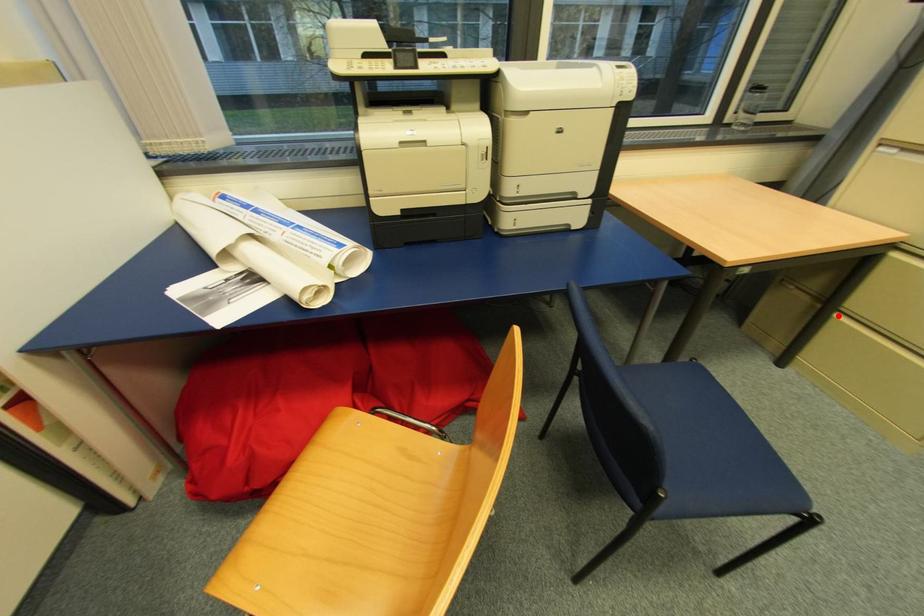
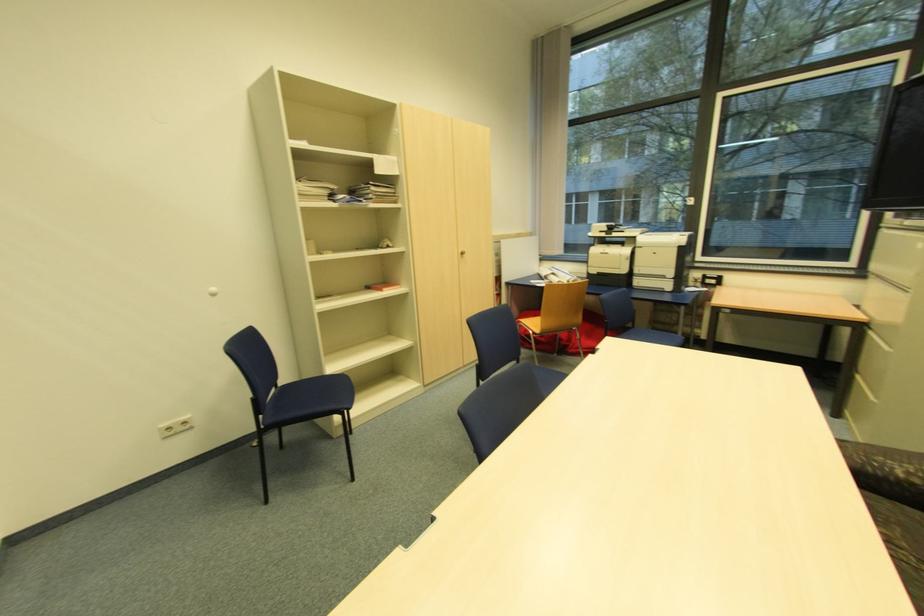
Question: I am providing you with two images of the same scene from different viewpoints. In image1, a red point is highlighted. Considering the same 3D point in image2, which of the following is correct?

Choices:
 (A) It is closer
 (B) It is farther

Answer: (B)